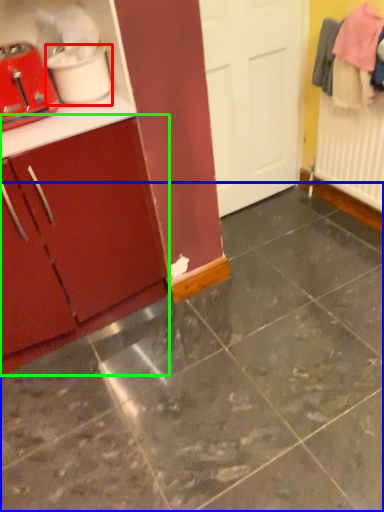
Question: Which object is the farthest from appliance (highlighted by a red box)? Choose among these: concrete (highlighted by a blue box) or cabinetry (highlighted by a green box).

Choices:
 (A) concrete
 (B) cabinetry

Answer: (A)